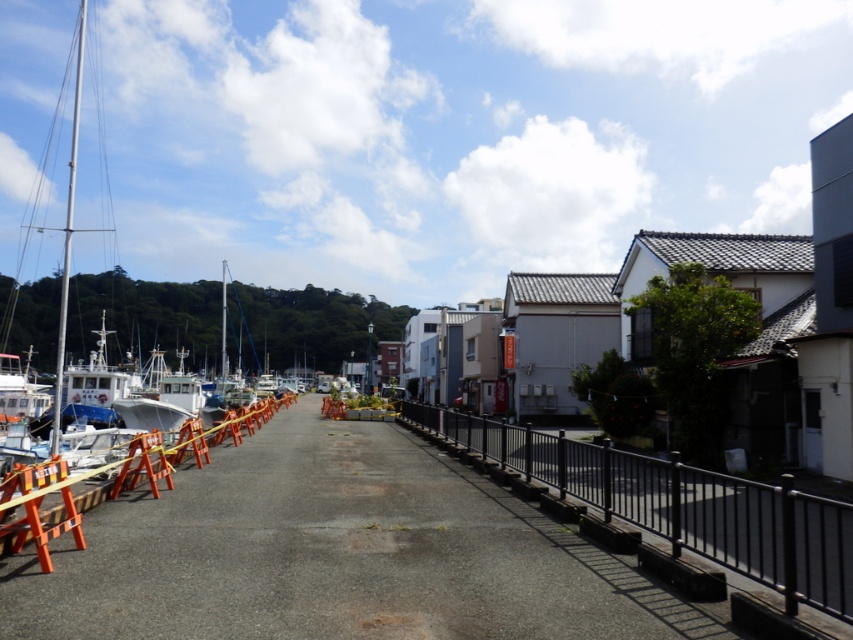
Who is more distant from viewer, (10, 563) or (619, 508)?

Positioned behind is point (619, 508).

Does point (234, 605) come closer to viewer compared to point (770, 524)?

Yes, point (234, 605) is closer to viewer.

Image resolution: width=853 pixels, height=640 pixels. I want to click on smooth asphalt path at center, so click(x=337, y=554).